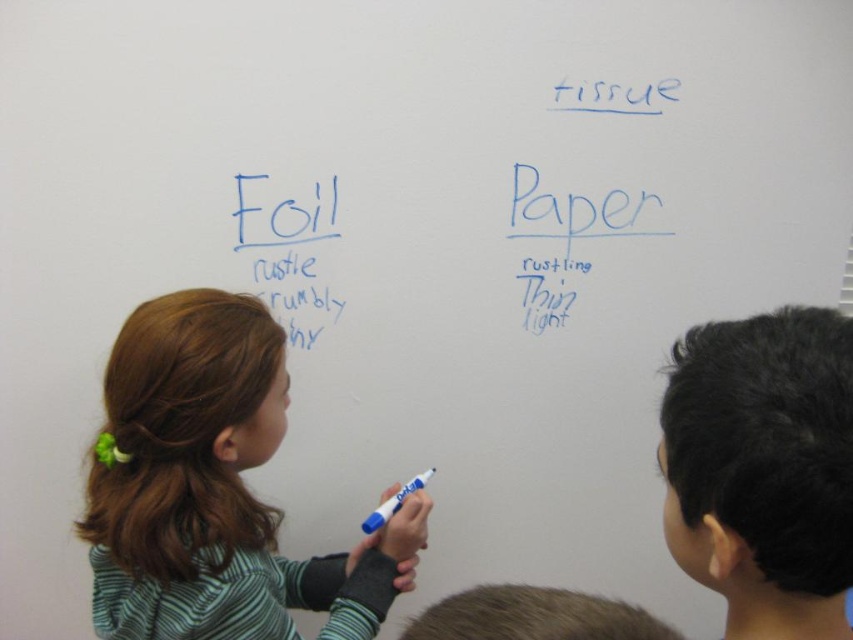
Question: Which object is closer to the camera taking this photo?

Choices:
 (A) green striped shirt at center left
 (B) black hair at upper right
 (C) blue marker at center

Answer: (B)

Question: Is black hair at upper right in front of blue marker at center?

Choices:
 (A) no
 (B) yes

Answer: (B)

Question: Which point is closer to the camera?

Choices:
 (A) black hair at upper right
 (B) green striped shirt at center left

Answer: (A)

Question: Which point is closer to the camera?

Choices:
 (A) (767, 502)
 (B) (142, 598)
 (C) (427, 472)

Answer: (A)

Question: Where is green striped shirt at center left located in relation to blue marker at center in the image?

Choices:
 (A) above
 (B) below

Answer: (A)

Question: Is green striped shirt at center left below blue marker at center?

Choices:
 (A) no
 (B) yes

Answer: (A)